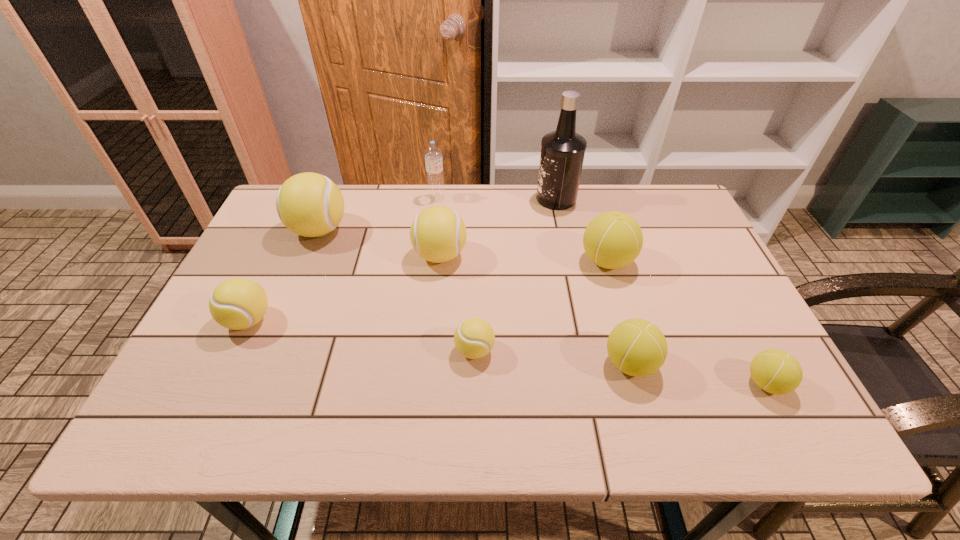
The width and height of the screenshot is (960, 540). Find the location of `free spot between the water bottle and the liquor`. free spot between the water bottle and the liquor is located at coordinates (496, 198).

I want to click on free space between the biggest yellow tennis ball and the third biggest yellow tennis ball, so click(x=284, y=275).

Identify the location of empty location between the second biggest yellow tennis ball and the rightmost object. This screenshot has height=540, width=960. (603, 320).

Select which object is the sixth closest to the second biggest green tennis ball. Please provide its 2D coordinates. Your answer should be formatted as a tuple, i.e. [(x, y)], where the tuple contains the x and y coordinates of a point satisfying the conditions above.

[(433, 154)]

The image size is (960, 540). Find the location of `object identified as the eighth closest to the biggest green tennis ball`. object identified as the eighth closest to the biggest green tennis ball is located at coordinates (238, 303).

Select which tennis ball is the sixth closest to the third smallest yellow tennis ball. Please provide its 2D coordinates. Your answer should be formatted as a tuple, i.e. [(x, y)], where the tuple contains the x and y coordinates of a point satisfying the conditions above.

[(775, 371)]

The height and width of the screenshot is (540, 960). I want to click on tennis ball that is the fourth closest to the second biggest green tennis ball, so tap(437, 234).

Choose which yellow tennis ball is the second nearest neighbor to the black liquor. Please provide its 2D coordinates. Your answer should be formatted as a tuple, i.e. [(x, y)], where the tuple contains the x and y coordinates of a point satisfying the conditions above.

[(474, 338)]

Locate which yellow tennis ball ranks second in proximity to the water bottle. Please provide its 2D coordinates. Your answer should be formatted as a tuple, i.e. [(x, y)], where the tuple contains the x and y coordinates of a point satisfying the conditions above.

[(309, 204)]

This screenshot has height=540, width=960. Identify the location of green tennis ball that stands as the closest to the second smallest green tennis ball. (775, 371).